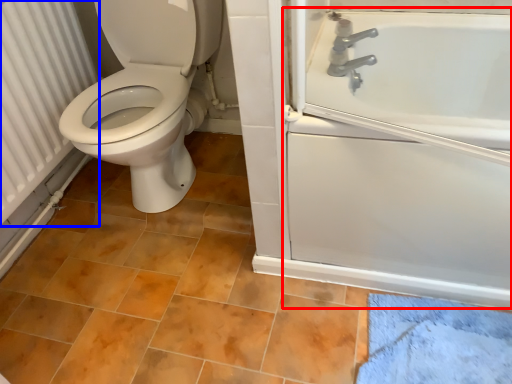
Question: Which object appears farthest to the camera in this image, bath (highlighted by a red box) or radiator (highlighted by a blue box)?

Choices:
 (A) bath
 (B) radiator

Answer: (B)